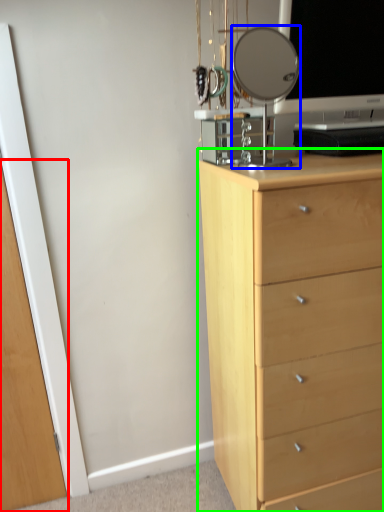
Question: Which is farther away from glass door (highlighted by a red box)? mirror (highlighted by a blue box) or chest of drawers (highlighted by a green box)?

Choices:
 (A) mirror
 (B) chest of drawers

Answer: (A)